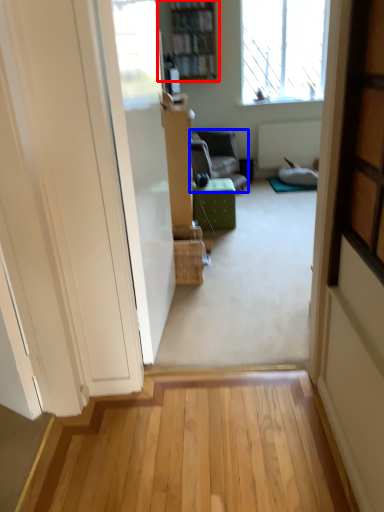
Question: Which point is further to the camera, bookcase (highlighted by a red box) or furniture (highlighted by a blue box)?

Choices:
 (A) bookcase
 (B) furniture

Answer: (A)